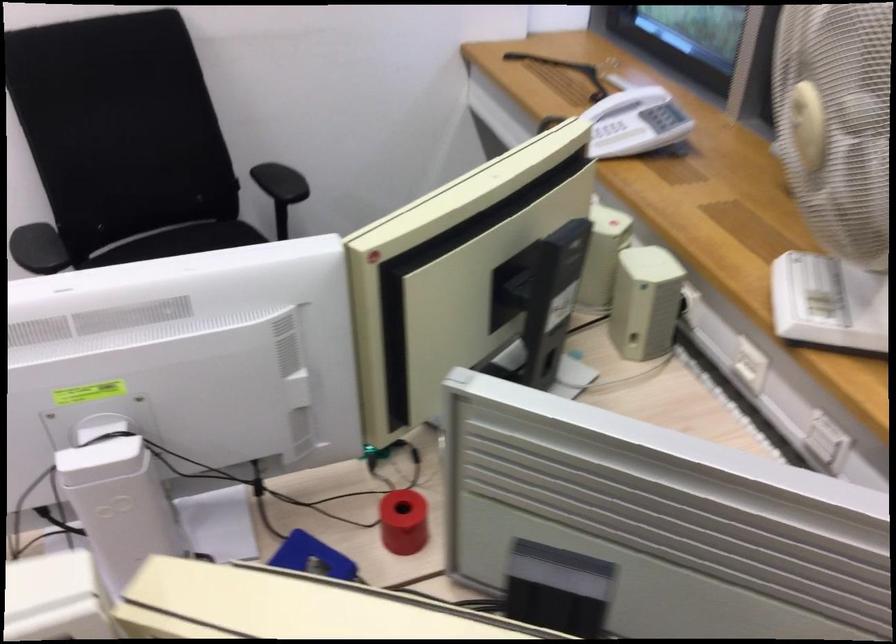
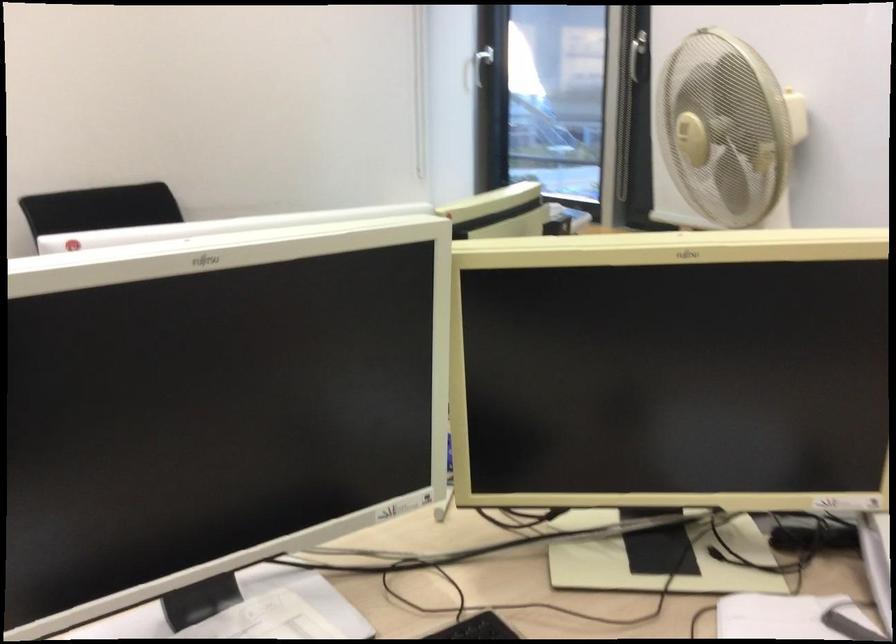
Question: I am providing you with two images of the same scene from different viewpoints. Please identify which objects are invisible in image2.

Choices:
 (A) white window handle
 (B) clear paper tray
 (C) chair sitting surface
 (D) fan control knob

Answer: (C)